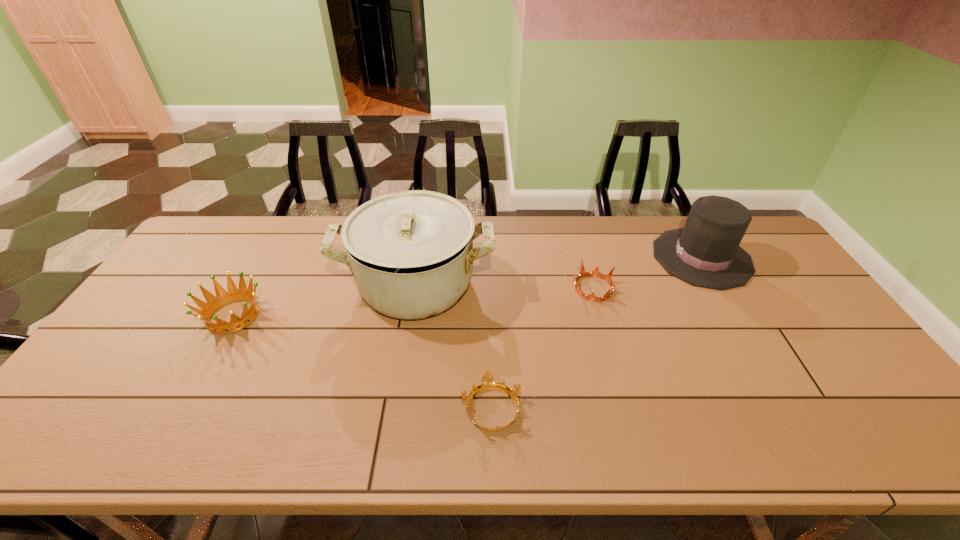
You are a GUI agent. You are given a task and a screenshot of the screen. Output one action in this format:
    pyautogui.click(x=<x>, y=<y>)
    Task: Click on the vacant space situated 0.350m on the front of the fourth shortest object with the decoration
    The width and height of the screenshot is (960, 540).
    Given the screenshot: What is the action you would take?
    pyautogui.click(x=546, y=258)

Locate an element on the screen. This screenshot has width=960, height=540. vacant space situated 0.260m on the front of the fourth shortest object with the decoration is located at coordinates (574, 258).

Where is `vacant space located 0.170m on the back of the tallest crown`? vacant space located 0.170m on the back of the tallest crown is located at coordinates point(266,258).

Identify the location of free space located 0.210m on the back of the rightmost crown. (579, 234).

You are a GUI agent. You are given a task and a screenshot of the screen. Output one action in this format:
    pyautogui.click(x=<x>, y=<y>)
    Task: Click on the free location located 0.100m on the back of the second crown from left to right
    The image size is (960, 540).
    Given the screenshot: What is the action you would take?
    pyautogui.click(x=490, y=352)

The image size is (960, 540). I want to click on saucepan situated at the far edge, so click(x=411, y=253).

Where is `dress hat that is at the far edge`? Image resolution: width=960 pixels, height=540 pixels. dress hat that is at the far edge is located at coordinates [x=706, y=253].

The height and width of the screenshot is (540, 960). I want to click on object at the near edge, so click(488, 384).

Find the location of a particular element. Image resolution: width=960 pixels, height=540 pixels. object that is at the right edge is located at coordinates (706, 253).

Image resolution: width=960 pixels, height=540 pixels. I want to click on object located in the far right corner section of the desktop, so click(706, 253).